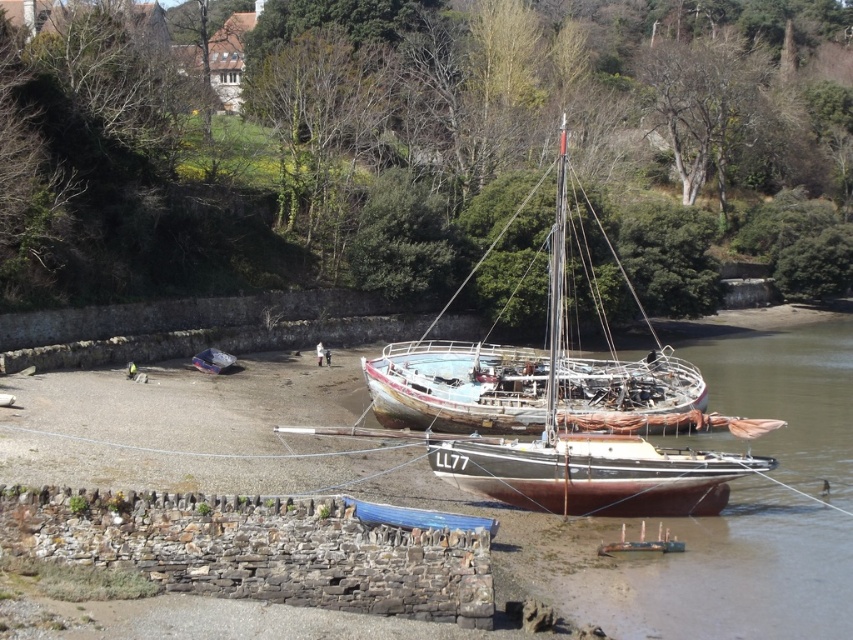
You are a dock worker who needs to secure both the rusty metal sailboat at center and the rusty wooden boat at center. Given their positions, which boat should you secure first to ensure stability during high tide?

The rusty metal sailboat at center is above the rusty wooden boat at center, so you should secure the rusty wooden boat at center first as it is lower and more vulnerable to rising water during high tide.

You are standing at the stone wall with the blue tarp and want to place a small marker at two specific points. The first point is at coordinates point (647, 506) and the second point is at point (503, 412). Which point is closer to you?

Point (647, 506) is closer to the viewer than point (503, 412).

You are a dock worker needing to move the rusty wooden boat at center to a storage area. The entrance to the storage area is only 2 meters wide. Can the rusty metal sailboat at center pass through the entrance without removing any parts?

The rusty metal sailboat at center has a greater width than the rusty wooden boat at center. Since the entrance is 2 meters wide, we need to know the exact width of the rusty metal sailboat at center to determine if it can pass. However, the provided information only states that it is wider than the wooden boat, but not its specific measurement. Therefore, without additional data, it is impossible to confirm if it will fit through the 2 meter entrance.